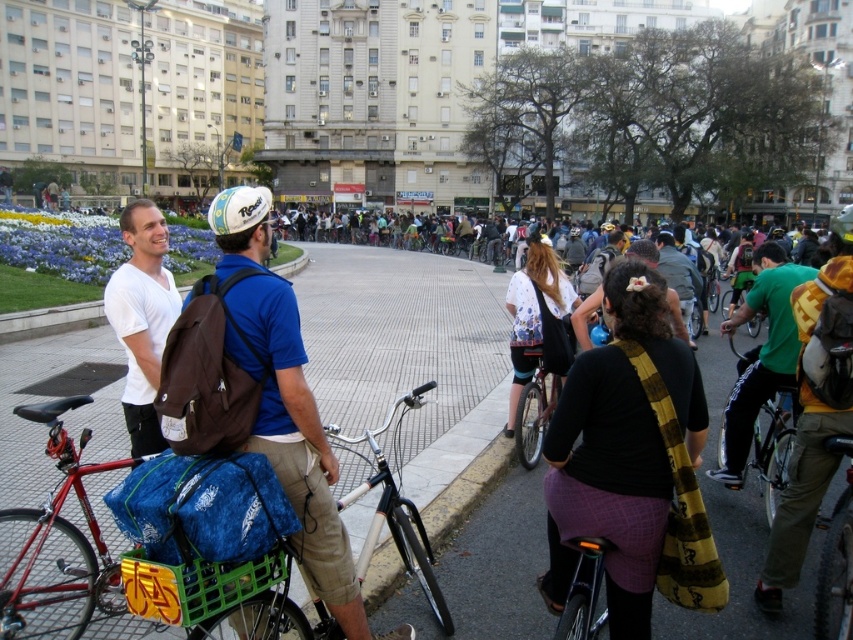
You are standing at point (x=728, y=326) and want to reach a nearby coffee shop located at point 0.855, 0.512. The city has a strict rule that you can only move along the grid lines of the square. What is the shortest distance you need to walk in meters?

The shortest path along the grid lines would be the Manhattan distance, which is calculated by adding the absolute differences of the x and y coordinates. The difference in the x direction is 0.855 minus 0.512 equals 0.343, and the difference in the y direction is also 0.512 minus 0.855 equals 0.343. Adding these together gives 0.686 units. Since the objects are 31.98 meters apart, each unit corresponds to 31.98 divided by 0.686, which is approximately 46.6 meters per unit. Multiplying 0.686 units by 46.6 m

You are a delivery person who needs to attach a package to your bicycle. The package is 15 cm wide. You see the dark gray backpack at center and the green matte bicycle helmet at center. Which item can the package fit next to without exceeding its width?

The package can fit next to the dark gray backpack at center because its width is less than the green matte bicycle helmet at center.

You are a participant in a cycling event and need to secure your gear properly. You have a dark gray backpack at center and a green matte bicycle helmet at center. Which item should you place on the top shelf of your bike rack if the shelf has limited height?

The dark gray backpack at center should be placed on the top shelf because it is shorter than the green matte bicycle helmet at center, making it more suitable for the limited height space.